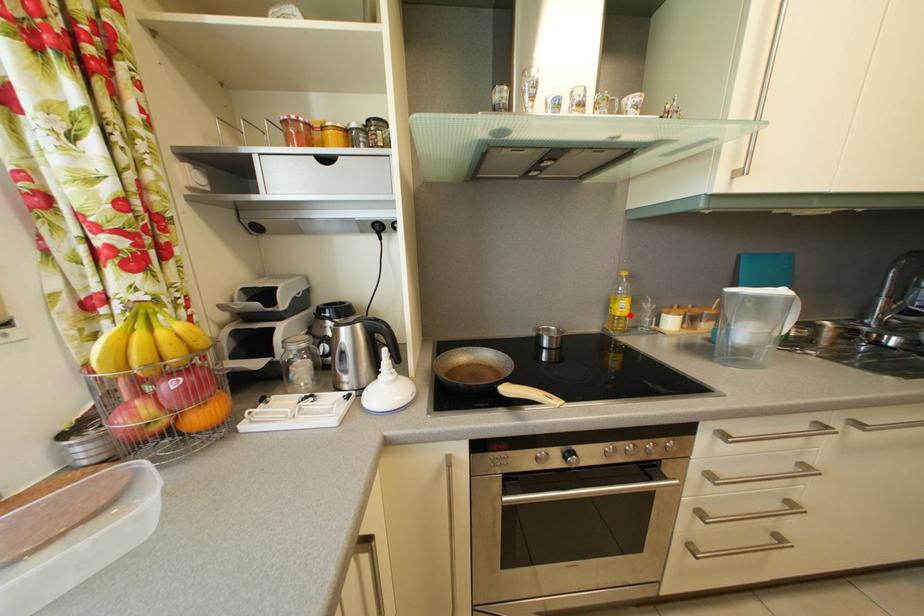
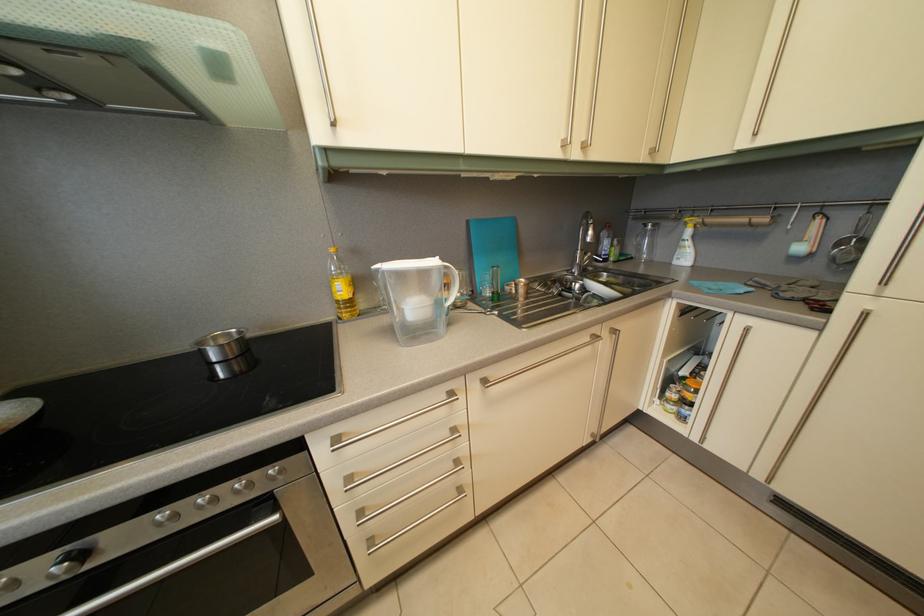
In the second image, find the point that corresponds to the highlighted location in the first image.

(349, 297)